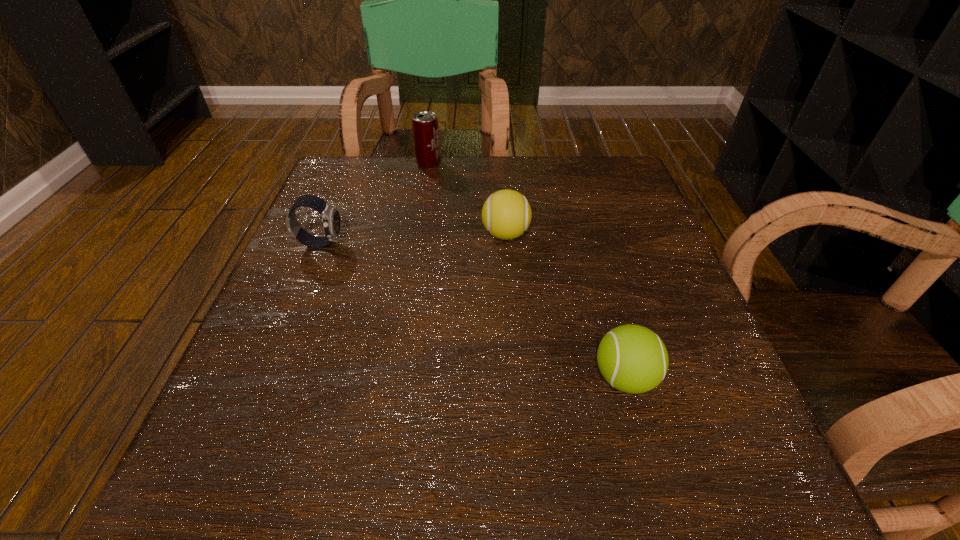
Locate an element on the screen. unoccupied position between the watch and the nearer tennis ball is located at coordinates (472, 310).

Where is `vacant space that's between the left tennis ball and the right tennis ball`? Image resolution: width=960 pixels, height=540 pixels. vacant space that's between the left tennis ball and the right tennis ball is located at coordinates (565, 306).

Image resolution: width=960 pixels, height=540 pixels. Find the location of `the third closest object relative to the rightmost object`. the third closest object relative to the rightmost object is located at coordinates (425, 127).

Locate an element on the screen. object that is the third nearest to the leftmost object is located at coordinates (633, 359).

Locate an element on the screen. The image size is (960, 540). free space that satisfies the following two spatial constraints: 1. on the front side of the third object from left to right; 2. on the face of the watch is located at coordinates (506, 244).

Image resolution: width=960 pixels, height=540 pixels. I want to click on free space that satisfies the following two spatial constraints: 1. on the face of the leftmost object; 2. on the right side of the rightmost object, so click(x=266, y=378).

Find the location of `free space in the image that satisfies the following two spatial constraints: 1. on the face of the nearest object; 2. on the right side of the watch`. free space in the image that satisfies the following two spatial constraints: 1. on the face of the nearest object; 2. on the right side of the watch is located at coordinates (266, 378).

Where is `free point that satisfies the following two spatial constraints: 1. on the back side of the right tennis ball; 2. on the face of the watch`? The image size is (960, 540). free point that satisfies the following two spatial constraints: 1. on the back side of the right tennis ball; 2. on the face of the watch is located at coordinates tap(588, 244).